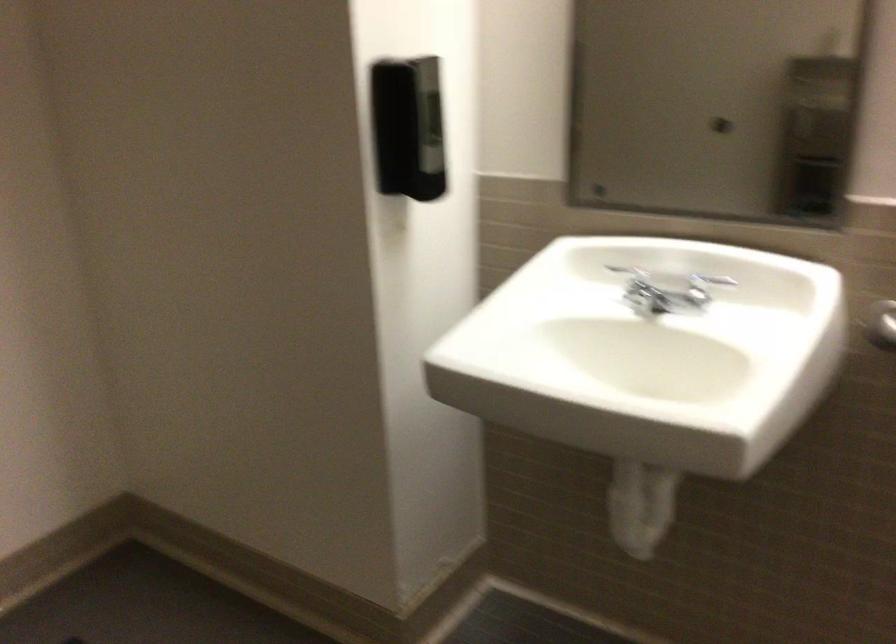
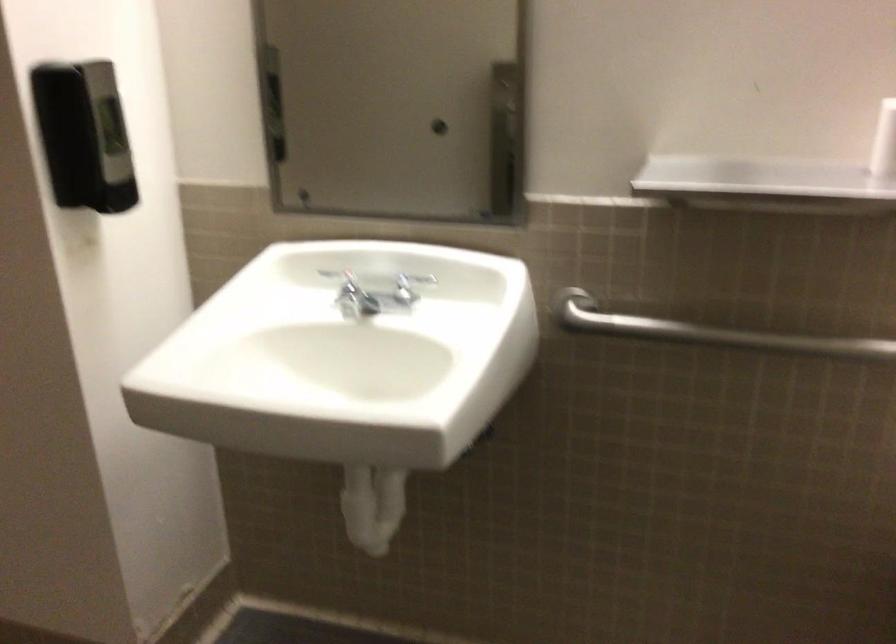
In the second image, find the point that corresponds to the point at 407,124 in the first image.

(83, 136)